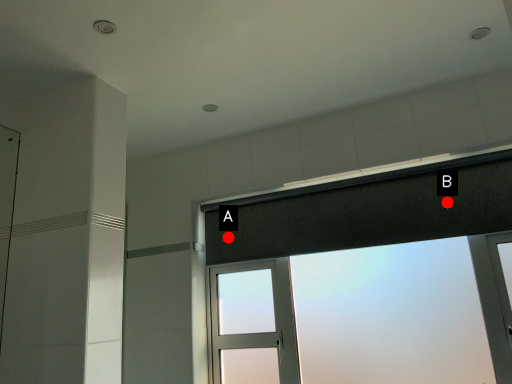
Question: Two points are circled on the image, labeled by A and B beside each circle. Among these points, which one is farthest from the camera?

Choices:
 (A) A is further
 (B) B is further

Answer: (A)